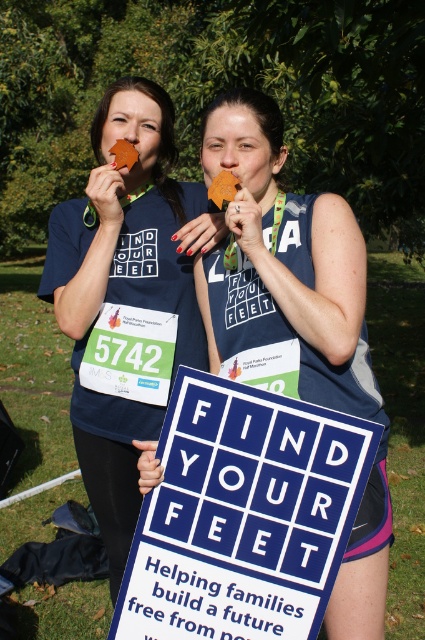
Question: Which is farther from the matte blue tank top at center?

Choices:
 (A) blue cardboard sign at center
 (B) matte blue t-shirt at center
 (C) brown paper leaf at center

Answer: (B)

Question: Which of these objects is positioned farthest from the matte blue t-shirt at center?

Choices:
 (A) brown paper leaf at center
 (B) blue cardboard sign at center
 (C) matte blue tank top at center

Answer: (B)

Question: Does blue cardboard sign at center appear on the right side of matte blue t-shirt at center?

Choices:
 (A) no
 (B) yes

Answer: (B)

Question: Does matte blue t-shirt at center have a greater width compared to brown paper leaf at center?

Choices:
 (A) yes
 (B) no

Answer: (A)

Question: Which of these objects is positioned closest to the brown paper leaf at center?

Choices:
 (A) blue cardboard sign at center
 (B) matte blue tank top at center
 (C) matte blue t-shirt at center

Answer: (B)

Question: Is blue cardboard sign at center bigger than brown paper leaf at center?

Choices:
 (A) no
 (B) yes

Answer: (B)